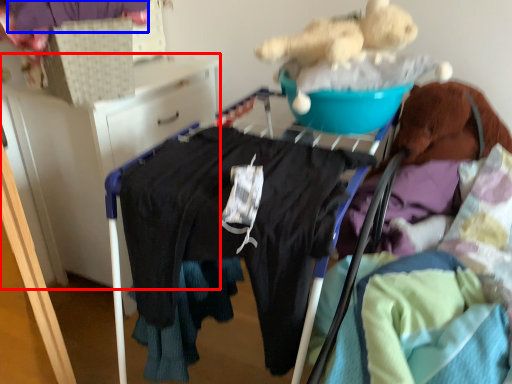
Question: Which of the following is the farthest to the observer, furniture (highlighted by a red box) or clothing (highlighted by a blue box)?

Choices:
 (A) furniture
 (B) clothing

Answer: (A)